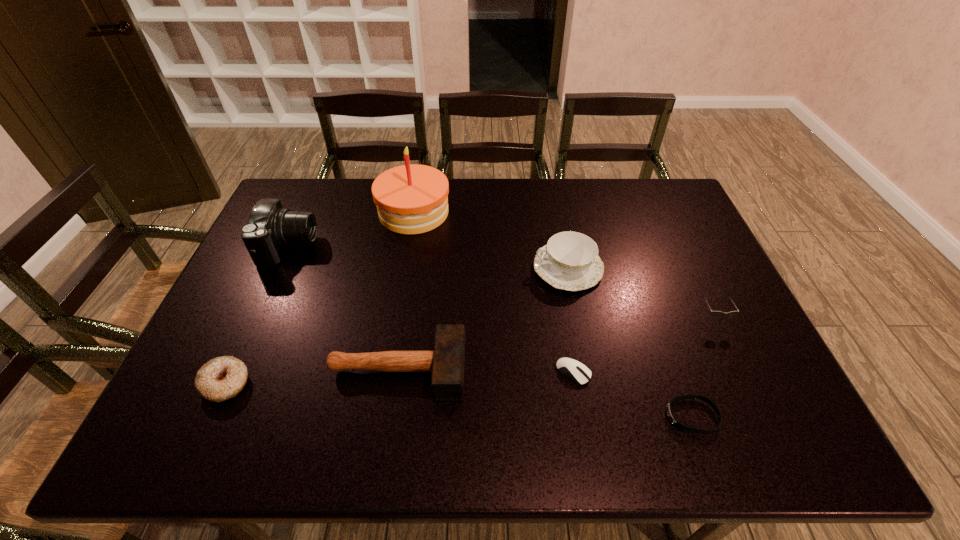
The width and height of the screenshot is (960, 540). Find the location of `vacant position located 0.220m on the right of the tallest object`. vacant position located 0.220m on the right of the tallest object is located at coordinates (516, 212).

Image resolution: width=960 pixels, height=540 pixels. What are the coordinates of `free space located on the lens of the second tallest object` in the screenshot? It's located at (333, 247).

Identify the location of vacant space located on the handle side of the chinaware. Image resolution: width=960 pixels, height=540 pixels. (496, 268).

I want to click on free region located 0.290m on the handle side of the chinaware, so click(x=435, y=268).

Identify the location of vacant space situated on the handle side of the chinaware. This screenshot has height=540, width=960. (432, 268).

This screenshot has width=960, height=540. Identify the location of blank space located 0.220m in front of the lenses of the rightmost object. (754, 407).

Identify the location of free space located on the hammer head face of the mallet. (614, 369).

Find the location of a particular element. The width and height of the screenshot is (960, 540). vacant space situated 0.110m on the front of the sixth tallest object is located at coordinates (194, 454).

Locate an element on the screen. The width and height of the screenshot is (960, 540). free location located on the right of the mouse is located at coordinates (678, 373).

Identify the location of free point located on the display of the seventh object from left to right. (545, 416).